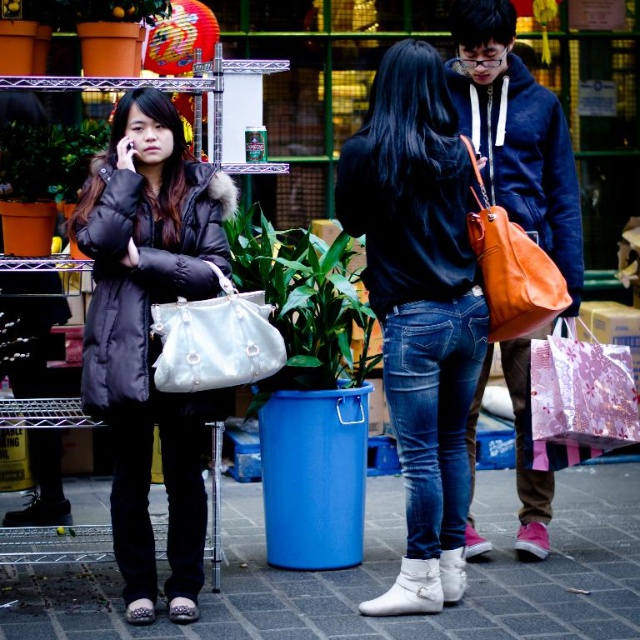
Question: Can you confirm if matte black jacket at center is thinner than white leather handbag at center?

Choices:
 (A) no
 (B) yes

Answer: (B)

Question: Can you confirm if matte orange leather bag at center is positioned to the right of blue plastic pot at center?

Choices:
 (A) yes
 (B) no

Answer: (A)

Question: Which of the following is the closest to the observer?

Choices:
 (A) white leather handbag at center
 (B) orange leather handbag at right

Answer: (A)

Question: Which of the following is the farthest from the observer?

Choices:
 (A) (518, 285)
 (B) (20, 177)

Answer: (B)

Question: Which object is positioned closest to the green leafy plant at left?

Choices:
 (A) blue plastic pot at center
 (B) white tile pavement at lower center
 (C) white leather handbag at center

Answer: (C)

Question: Does white tile pavement at lower center come behind orange leather handbag at right?

Choices:
 (A) yes
 (B) no

Answer: (B)